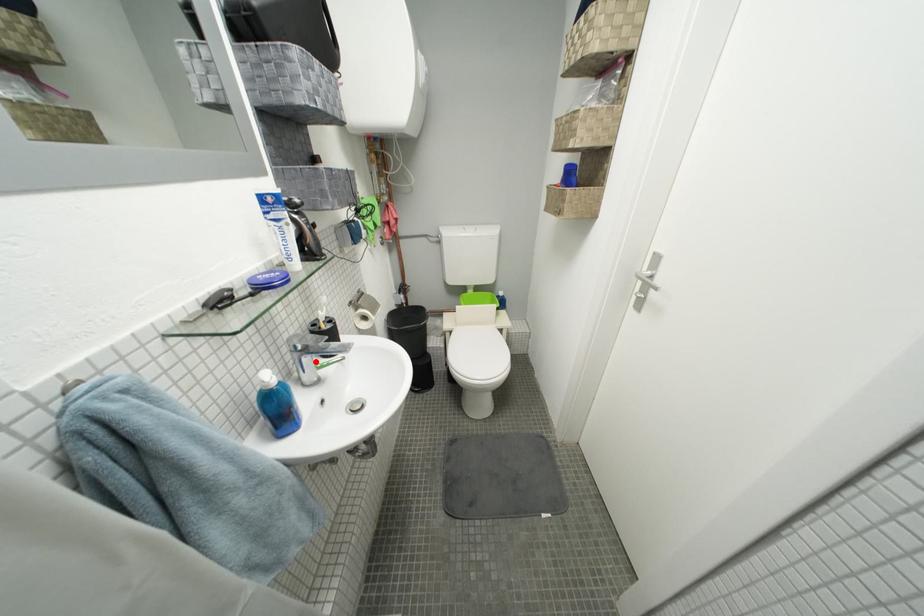
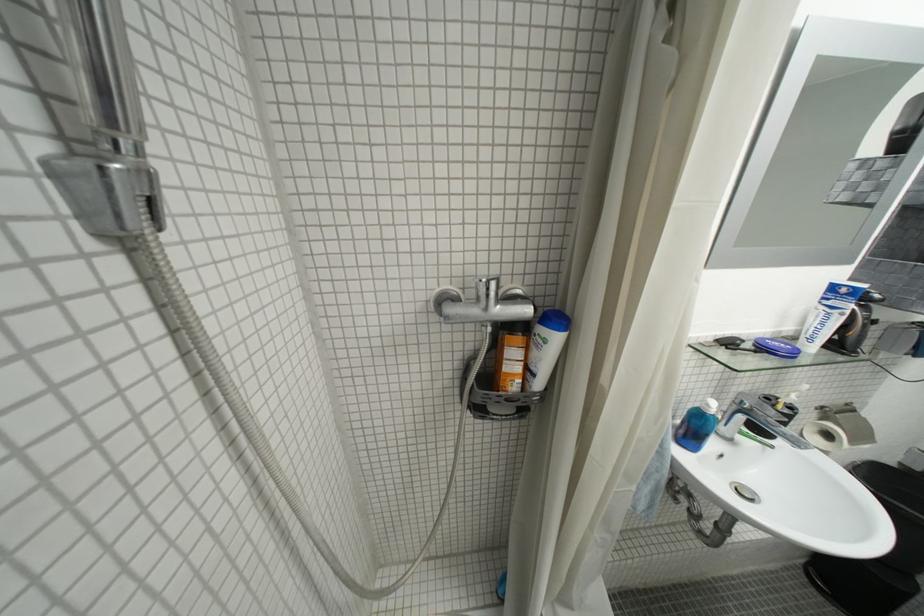
Where in the second image is the point corresponding to the highlighted location from the first image?

(749, 419)